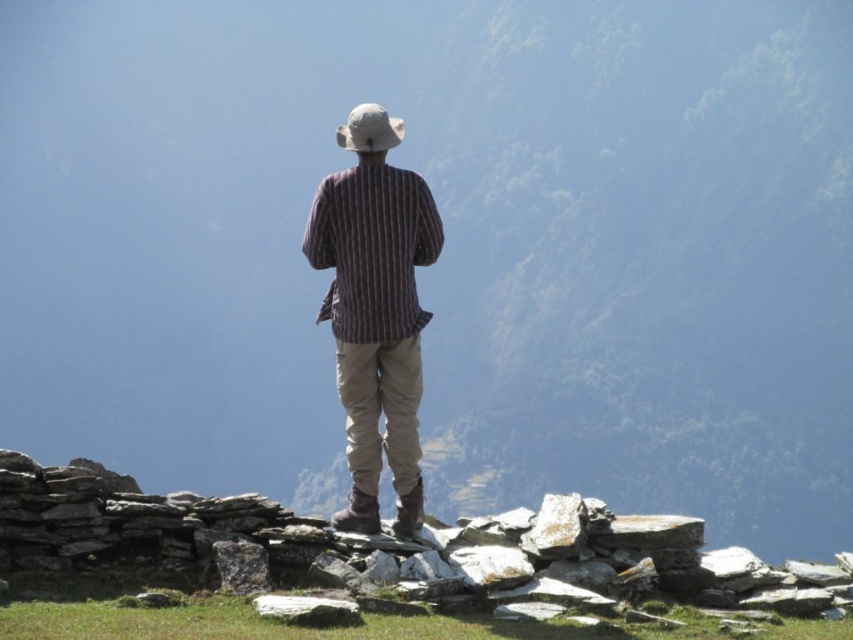
Question: Considering the real-world distances, which object is closest to the striped fabric shirt at center?

Choices:
 (A) striped cotton shirt at center
 (B) white fabric hat at center

Answer: (A)

Question: Does striped fabric shirt at center have a smaller size compared to white fabric hat at center?

Choices:
 (A) no
 (B) yes

Answer: (B)

Question: Is striped fabric shirt at center wider than white fabric hat at center?

Choices:
 (A) yes
 (B) no

Answer: (B)

Question: Does striped fabric shirt at center have a smaller size compared to striped cotton shirt at center?

Choices:
 (A) no
 (B) yes

Answer: (A)

Question: Which point is farther to the camera?

Choices:
 (A) white fabric hat at center
 (B) striped cotton shirt at center

Answer: (A)

Question: Which of the following is the closest to the observer?

Choices:
 (A) 390,122
 (B) 320,308
 (C) 364,307

Answer: (C)